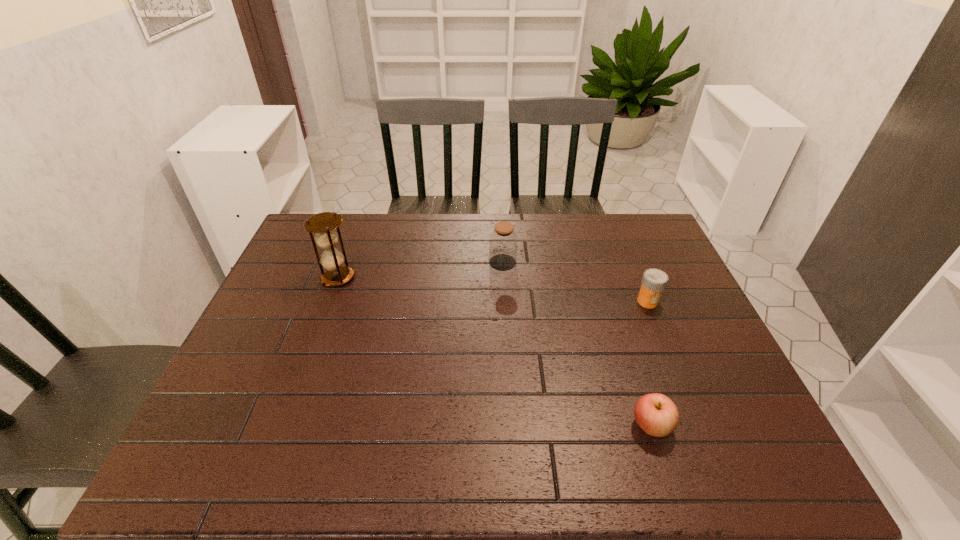
The width and height of the screenshot is (960, 540). Identify the location of hourglass. (323, 224).

Locate an element on the screen. the leftmost object is located at coordinates (323, 224).

Identify the location of the second tallest object. [x=503, y=240].

Find the location of a particular element. the second object from left to right is located at coordinates (503, 240).

The width and height of the screenshot is (960, 540). Find the location of `the third farthest object`. the third farthest object is located at coordinates (654, 281).

The height and width of the screenshot is (540, 960). What are the coordinates of `the rightmost object` in the screenshot? It's located at (654, 281).

Where is `the third object from left to right`? The image size is (960, 540). the third object from left to right is located at coordinates [656, 414].

Where is `apple`? apple is located at coordinates (656, 414).

At what (x,y) coordinates should I click in order to perform the action: click on free location located 0.280m on the right of the tallest object. Please return your answer as a coordinate pair (x, y). The width and height of the screenshot is (960, 540). Looking at the image, I should click on (448, 278).

At what (x,y) coordinates should I click in order to perform the action: click on vacant area located on the right of the third shortest object. Please return your answer as a coordinate pair (x, y). The image size is (960, 540). Looking at the image, I should click on (541, 262).